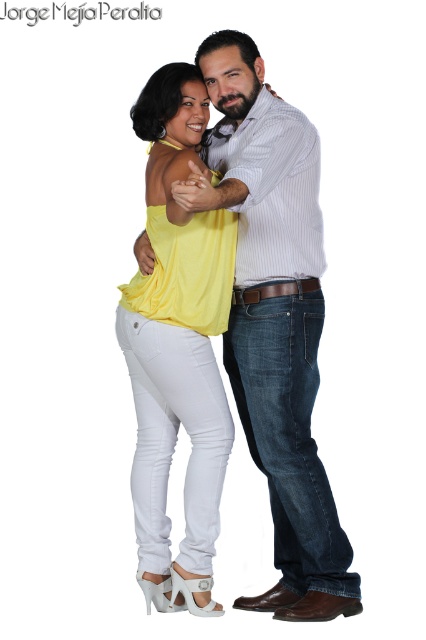
Question: Which of the following is the farthest from the observer?

Choices:
 (A) matte yellow blouse at center
 (B) white matte jeans at center

Answer: (A)

Question: Is white matte jeans at center closer to camera compared to matte yellow blouse at center?

Choices:
 (A) yes
 (B) no

Answer: (A)

Question: Observing the image, what is the correct spatial positioning of white matte jeans at center in reference to matte yellow blouse at center?

Choices:
 (A) above
 (B) below

Answer: (A)

Question: Which point is closer to the camera?

Choices:
 (A) white matte jeans at center
 (B) matte yellow blouse at center

Answer: (A)

Question: Is white matte jeans at center further to the viewer compared to matte yellow blouse at center?

Choices:
 (A) yes
 (B) no

Answer: (B)